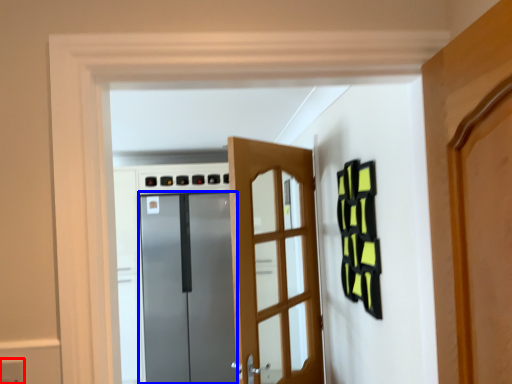
Question: Which of the following is the closest to the observer, electric outlet (highlighted by a red box) or door (highlighted by a blue box)?

Choices:
 (A) electric outlet
 (B) door

Answer: (A)